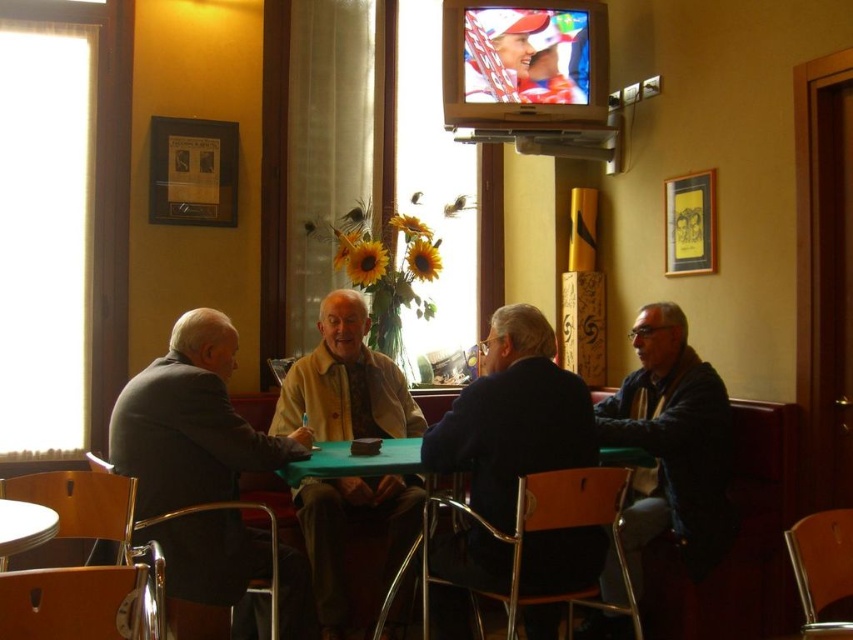
Question: Does dark blue jacket at right have a smaller size compared to metallic round table at lower left?

Choices:
 (A) no
 (B) yes

Answer: (A)

Question: Is dark blue jacket at right positioned behind metallic round table at lower left?

Choices:
 (A) no
 (B) yes

Answer: (B)

Question: Which of the following is the closest to the observer?

Choices:
 (A) coord(686,552)
 (B) coord(596,557)
 (C) coord(352,460)

Answer: (B)

Question: Can you confirm if dark blue jacket at right is bigger than light brown leather jacket at center?

Choices:
 (A) no
 (B) yes

Answer: (A)

Question: Which point is farther to the camera?

Choices:
 (A) dark gray suit at left
 (B) green fabric table at center

Answer: (B)

Question: Which point is farther from the camera taking this photo?

Choices:
 (A) (363, 467)
 (B) (180, 449)

Answer: (A)